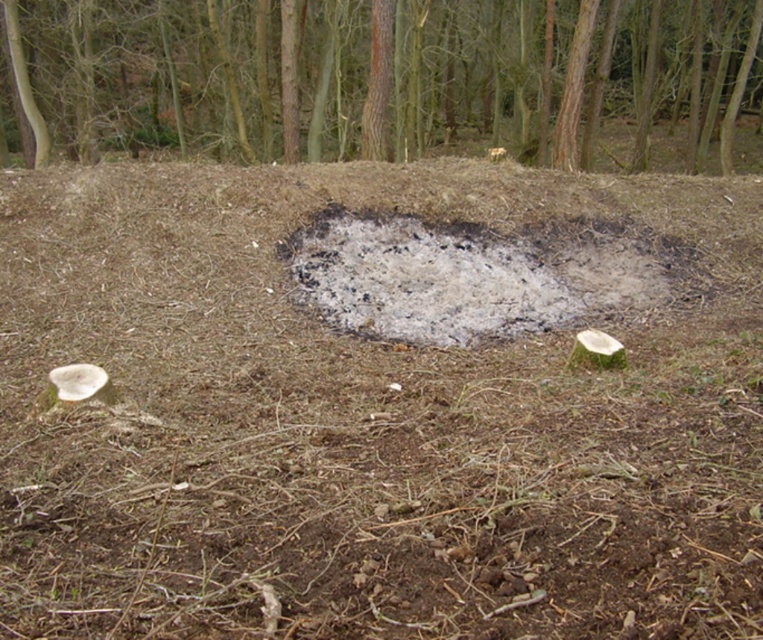
Question: Can you confirm if brown wood tree at upper center is positioned below ashy gray ash at center?

Choices:
 (A) no
 (B) yes

Answer: (A)

Question: Does brown wood tree at upper center come in front of ashy gray ash at center?

Choices:
 (A) no
 (B) yes

Answer: (A)

Question: Is brown wood tree at upper center positioned before ashy gray ash at center?

Choices:
 (A) no
 (B) yes

Answer: (A)

Question: Which of the following is the closest to the observer?

Choices:
 (A) (391, 248)
 (B) (40, 150)

Answer: (A)